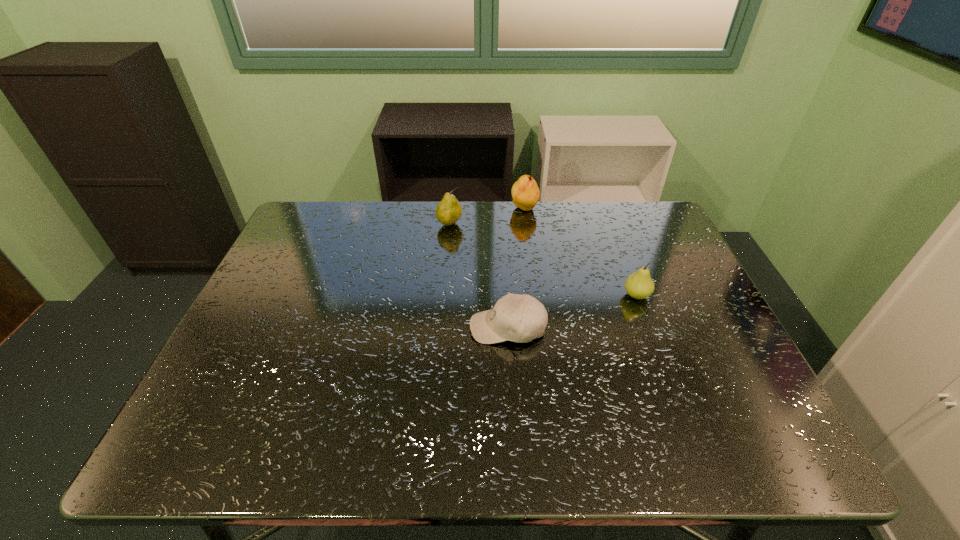
Find the location of `vacant space located 0.260m on the left of the rightmost object`. vacant space located 0.260m on the left of the rightmost object is located at coordinates (520, 295).

Find the location of a particular element. The image size is (960, 540). free space located 0.360m on the front-facing side of the baseball cap is located at coordinates (318, 327).

At what (x,y) coordinates should I click in order to perform the action: click on vacant space situated on the front-facing side of the baseball cap. Please return your answer as a coordinate pair (x, y). Looking at the image, I should click on (411, 327).

This screenshot has width=960, height=540. Identify the location of free space located 0.280m on the front-facing side of the baseball cap. (351, 327).

Identify the location of object at the right edge. (639, 285).

The width and height of the screenshot is (960, 540). In the image, there is a desktop. In order to click on vacant space at the far edge in this screenshot , I will do `click(590, 212)`.

In the image, there is a desktop. Identify the location of vacant area at the near edge. (303, 440).

The width and height of the screenshot is (960, 540). In the image, there is a desktop. What are the coordinates of `free region at the left edge` in the screenshot? It's located at coord(256,316).

Where is `vacant space at the right edge of the desktop`? Image resolution: width=960 pixels, height=540 pixels. vacant space at the right edge of the desktop is located at coordinates (681, 251).

Identify the location of blank space at the far left corner. (306, 245).